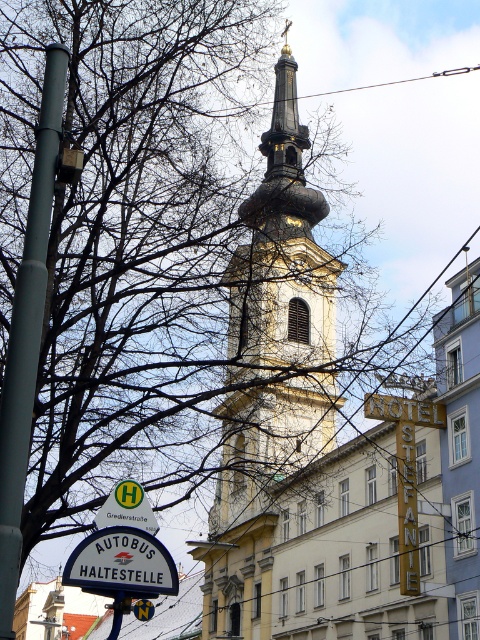
You are standing on Gredlerstrasse and see the yellow stone church at center and the metallic wire at upper center. Which object is positioned to the left when viewed from your perspective?

The yellow stone church at center is positioned to the left of the metallic wire at upper center from your perspective.

You are a tourist standing at the bus stop and want to take a photo of the yellow stone church at center. Since the white plastic sign at lower left is blocking your view, can you move to the right to get a clear shot without the sign in the frame?

The yellow stone church at center is wider than the white plastic sign at lower left. Moving to the right would allow you to position yourself so the sign is no longer blocking the church, as the church is wider and can be framed without the narrower sign obstructing it.